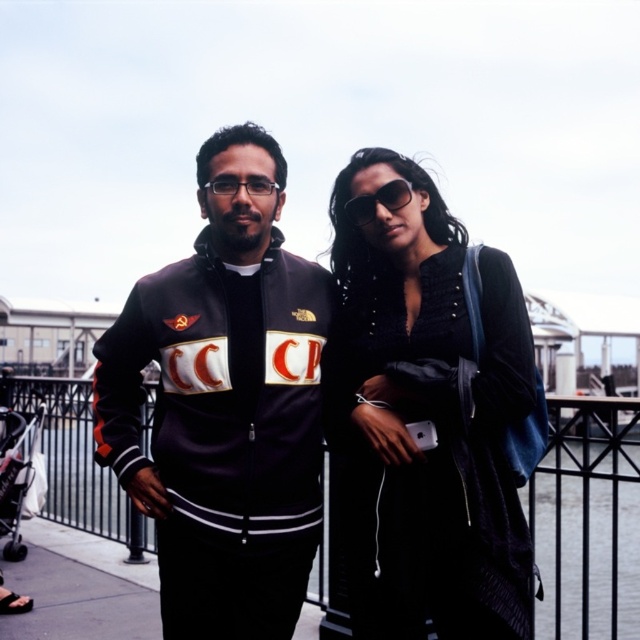
Question: Is black velvet dress at center above clear plastic glasses at center?

Choices:
 (A) no
 (B) yes

Answer: (A)

Question: Which is farther from the dark blue leather jacket at center?

Choices:
 (A) clear plastic glasses at center
 (B) sunglasses at center

Answer: (B)

Question: Among these points, which one is nearest to the camera?

Choices:
 (A) (468, 497)
 (B) (364, 196)
 (C) (266, 189)

Answer: (A)

Question: Observing the image, what is the correct spatial positioning of black metal fence at center in reference to clear plastic glasses at center?

Choices:
 (A) above
 (B) below

Answer: (B)

Question: Is dark blue leather jacket at center to the right of sunglasses at center from the viewer's perspective?

Choices:
 (A) yes
 (B) no

Answer: (B)

Question: Which of the following is the farthest from the observer?

Choices:
 (A) (502, 448)
 (B) (168, 483)
 (C) (108, 497)

Answer: (C)